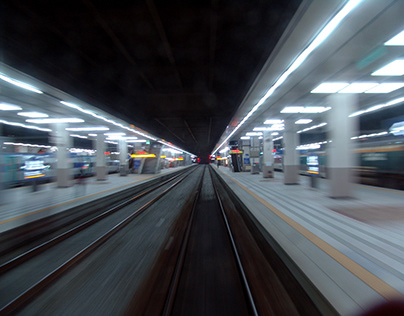
This screenshot has width=404, height=316. Find the location of `concourse ceiling`. concourse ceiling is located at coordinates (49, 108), (370, 33).